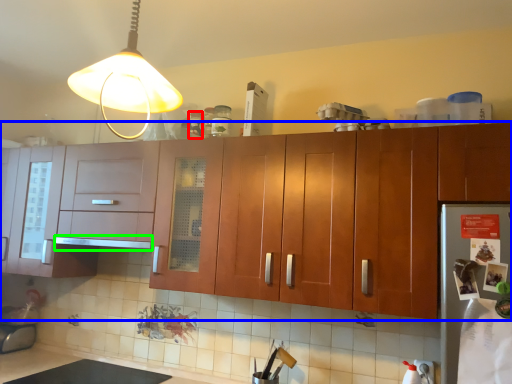
Question: Estimate the real-world distances between objects in this image. Which object is farther from bottle (highlighted by a red box), cabinetry (highlighted by a blue box) or exhaust hood (highlighted by a green box)?

Choices:
 (A) cabinetry
 (B) exhaust hood

Answer: (A)